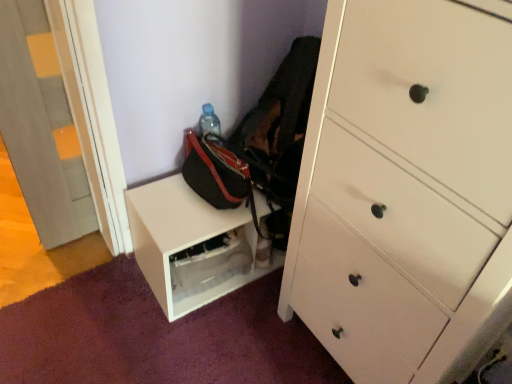
This screenshot has width=512, height=384. What are the coordinates of `free space on the front side of matte gray door at left` in the screenshot? It's located at (56, 269).